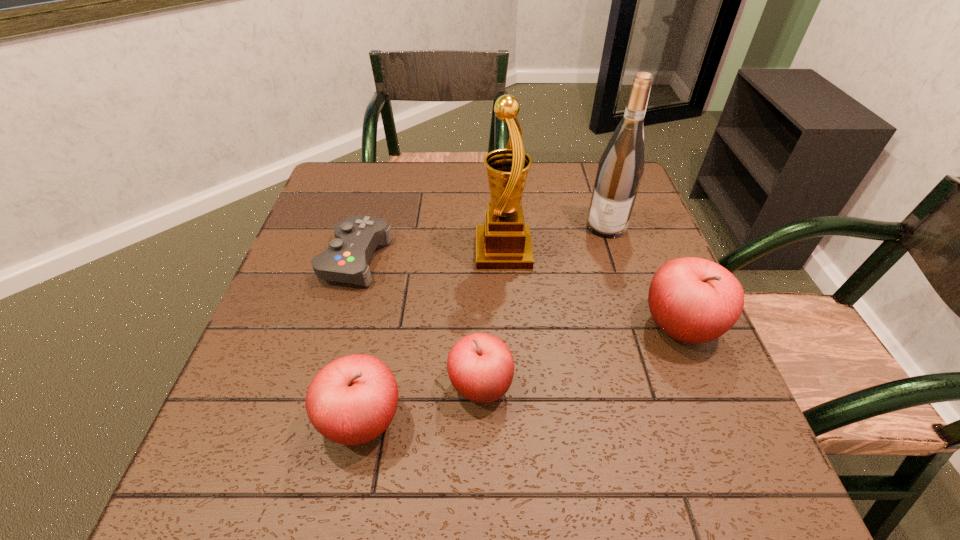
Locate an element on the screen. Image resolution: width=960 pixels, height=540 pixels. vacant area in the image that satisfies the following two spatial constraints: 1. on the back side of the second shortest object; 2. on the left side of the rightmost apple is located at coordinates (481, 327).

What are the coordinates of `free spot that satisfies the following two spatial constraints: 1. on the front side of the wine bottle; 2. on the right side of the rightmost apple` in the screenshot? It's located at (639, 327).